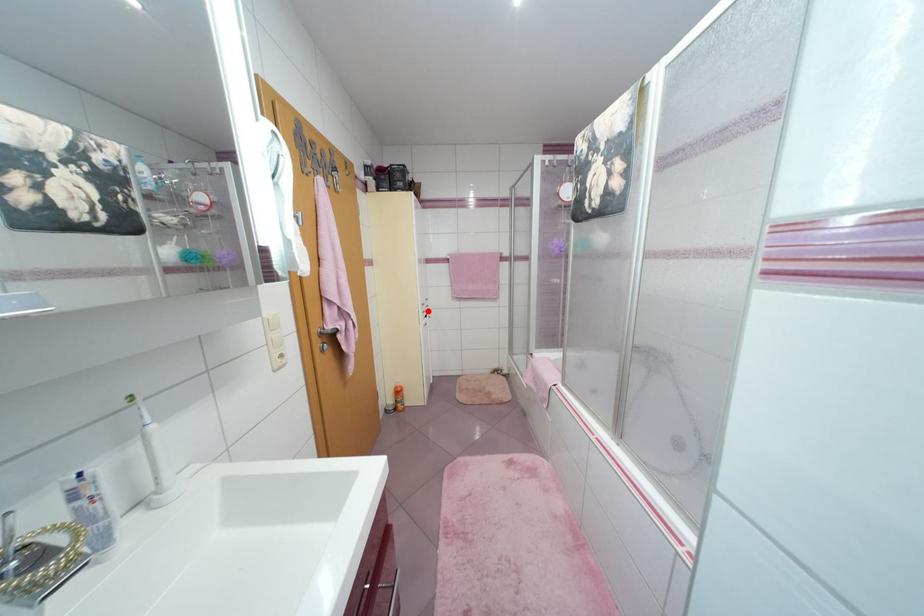
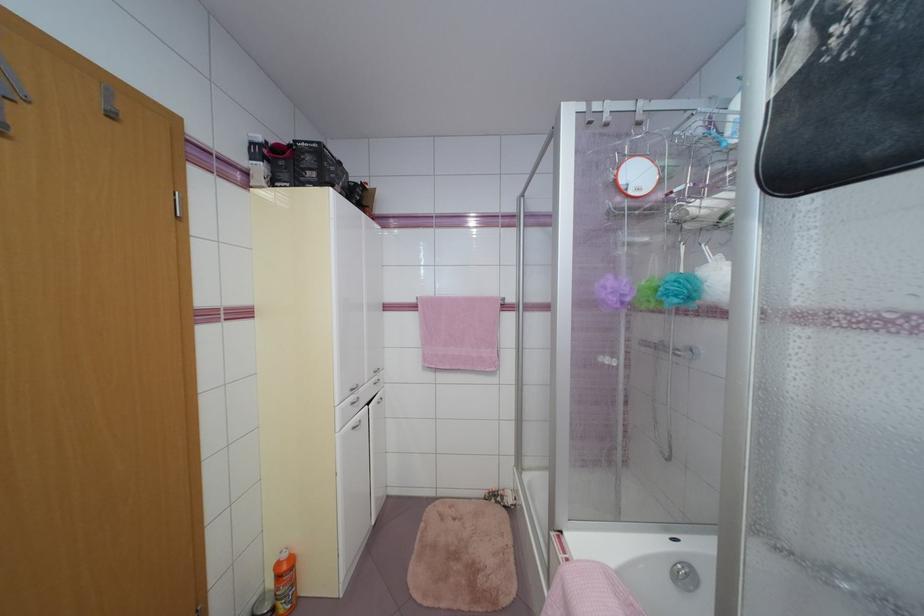
The point at the highlighted location is marked in the first image. Where is the corresponding point in the second image?

(357, 400)